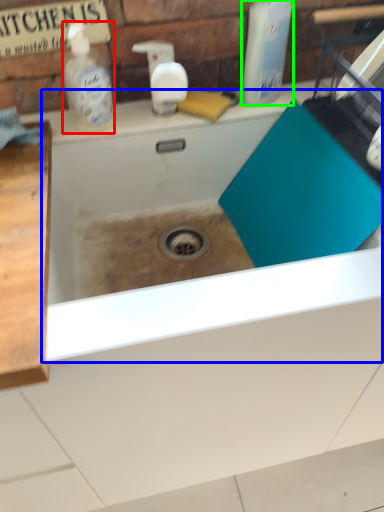
Question: Which object is positioned farthest from cleaning product (highlighted by a red box)? Select from bath (highlighted by a blue box) and cleaning product (highlighted by a green box).

Choices:
 (A) bath
 (B) cleaning product

Answer: (B)